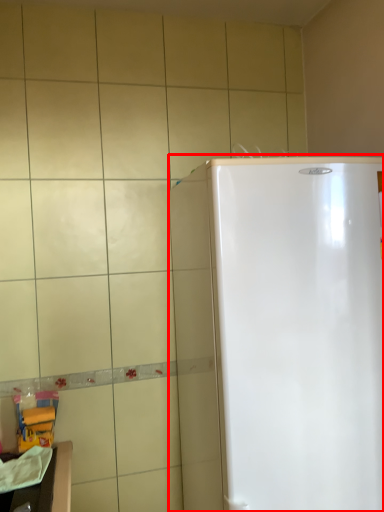
Question: From the image, what is the correct spatial relationship of refrigerator (annotated by the red box) in relation to counter top?

Choices:
 (A) right
 (B) left

Answer: (A)